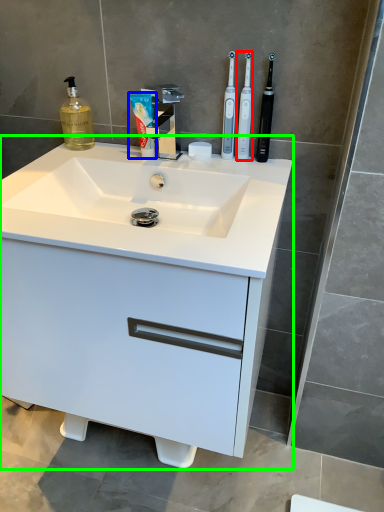
Question: Which object is positioned farthest from toothbrush (highlighted by a red box)? Select from toothpaste (highlighted by a blue box) and bathroom cabinet (highlighted by a green box).

Choices:
 (A) toothpaste
 (B) bathroom cabinet

Answer: (B)